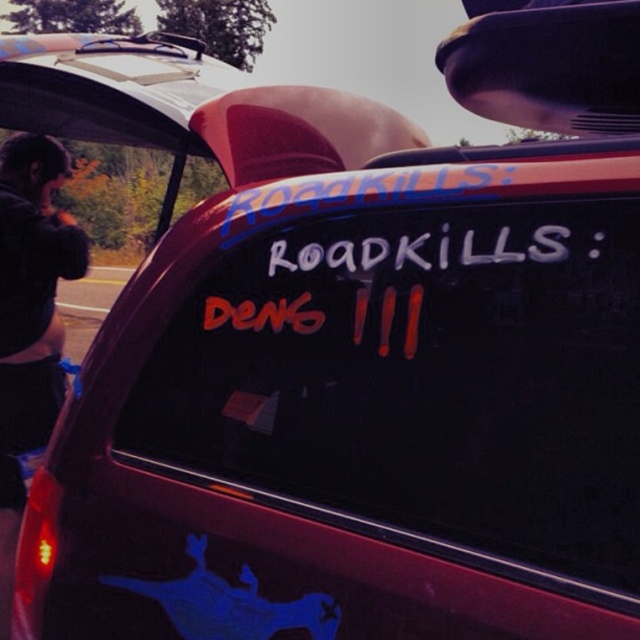
Can you confirm if white paint road sign at center is positioned above black fabric jacket at left?

Indeed, white paint road sign at center is positioned over black fabric jacket at left.

Between white paint road sign at center and black fabric jacket at left, which one is positioned lower?

Positioned lower is black fabric jacket at left.

I want to click on white paint road sign at center, so click(381, 276).